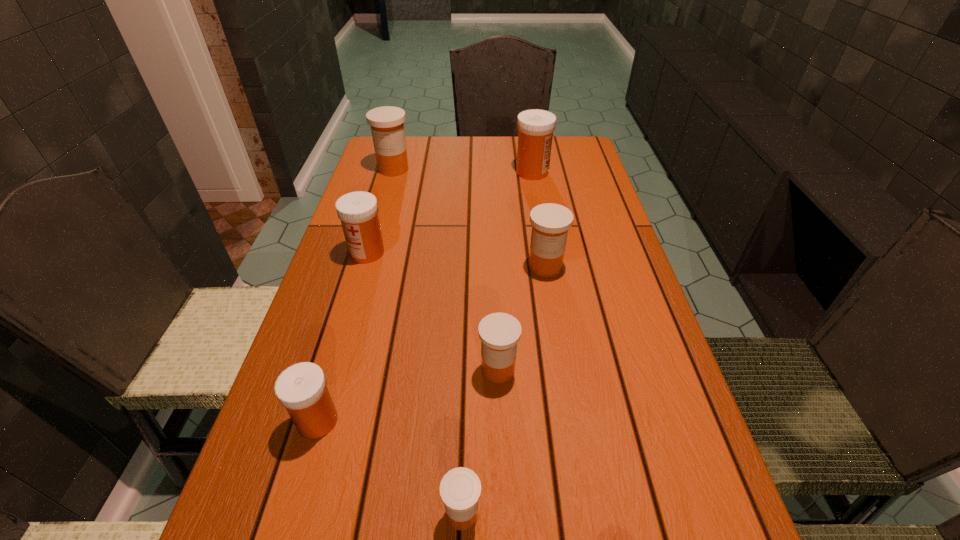
Find the location of a particular element. The image size is (960, 540). the farthest white medicine is located at coordinates (535, 127).

Locate an element on the screen. the rightmost white medicine is located at coordinates (535, 127).

Locate an element on the screen. the biggest orange medicine is located at coordinates (386, 122).

Where is `the leftmost orange medicine`? Image resolution: width=960 pixels, height=540 pixels. the leftmost orange medicine is located at coordinates (386, 122).

At what (x,y) coordinates should I click in order to perform the action: click on the third nearest orange medicine. Please return your answer as a coordinate pair (x, y). The width and height of the screenshot is (960, 540). Looking at the image, I should click on (550, 222).

I want to click on the second biggest orange medicine, so click(550, 222).

The width and height of the screenshot is (960, 540). I want to click on the second nearest white medicine, so click(358, 211).

The height and width of the screenshot is (540, 960). Find the location of `the second nearest orange medicine`. the second nearest orange medicine is located at coordinates (499, 333).

Identify the location of the second smallest orange medicine. (499, 333).

In order to click on the sixth farthest medicine in this screenshot , I will do `click(301, 388)`.